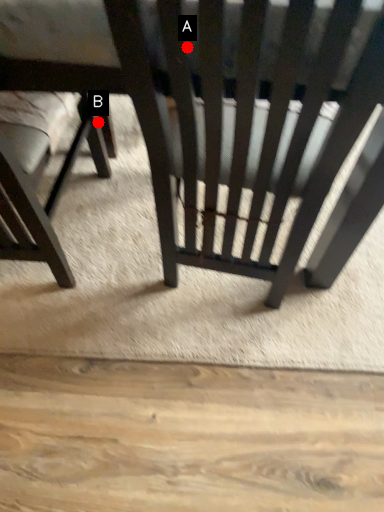
Question: Two points are circled on the image, labeled by A and B beside each circle. Which point is farther to the camera?

Choices:
 (A) A is further
 (B) B is further

Answer: (B)